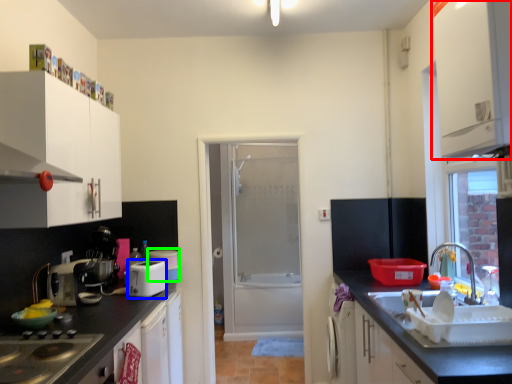
Question: Based on their relative distances, which object is farther from cabinetry (highlighted by a red box)? Choose from appliance (highlighted by a blue box) and appliance (highlighted by a green box).

Choices:
 (A) appliance
 (B) appliance

Answer: (B)